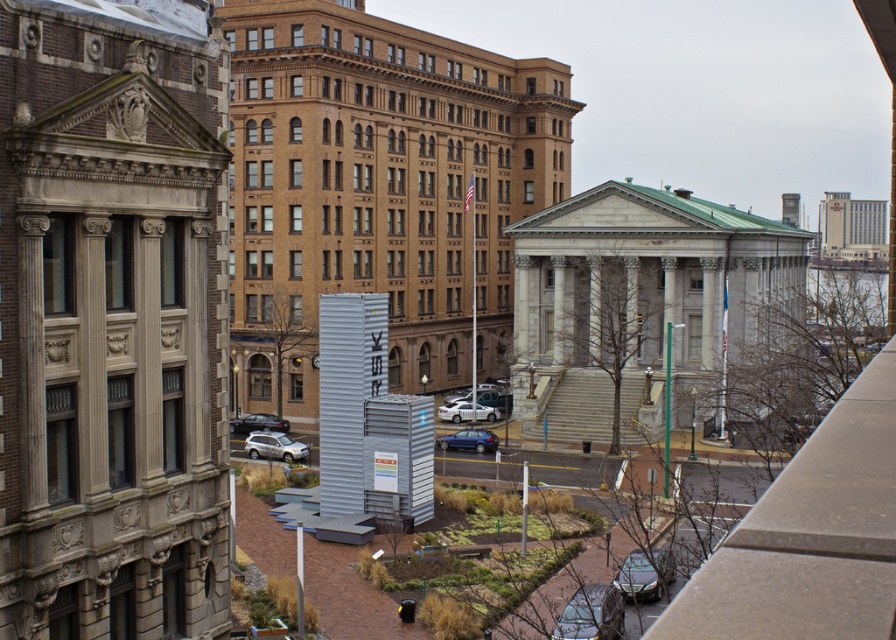
Question: Does gray metallic tower at left have a larger size compared to white matte car at center?

Choices:
 (A) no
 (B) yes

Answer: (B)

Question: Does gray metallic tower at left appear under blue metallic hatchback at center?

Choices:
 (A) yes
 (B) no

Answer: (B)

Question: Which point is farther to the camera?

Choices:
 (A) shiny black car at lower right
 (B) shiny black car at lower left
 (C) white matte car at center
 (D) gray metallic tower at left

Answer: (C)

Question: Which point is closer to the camera taking this photo?

Choices:
 (A) (471, 448)
 (B) (649, 586)
 (C) (352, 248)
 (D) (286, 426)

Answer: (B)

Question: Is blue metallic hatchback at center below white matte car at center?

Choices:
 (A) yes
 (B) no

Answer: (A)

Question: Which object appears farthest from the camera in this image?

Choices:
 (A) blue metallic hatchback at center
 (B) white corrugated metal container at center
 (C) satin silver suv at lower left
 (D) metallic silver car at lower center

Answer: (A)